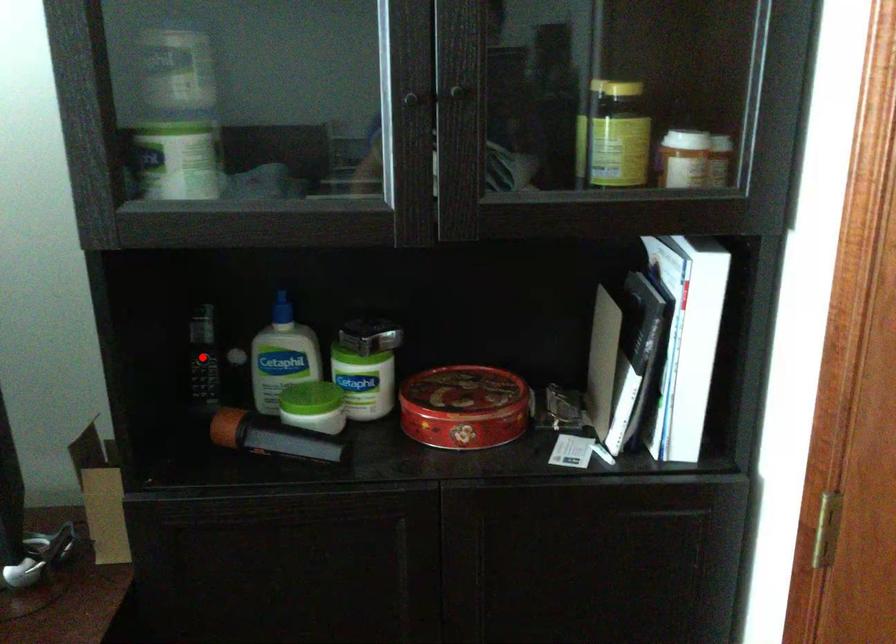
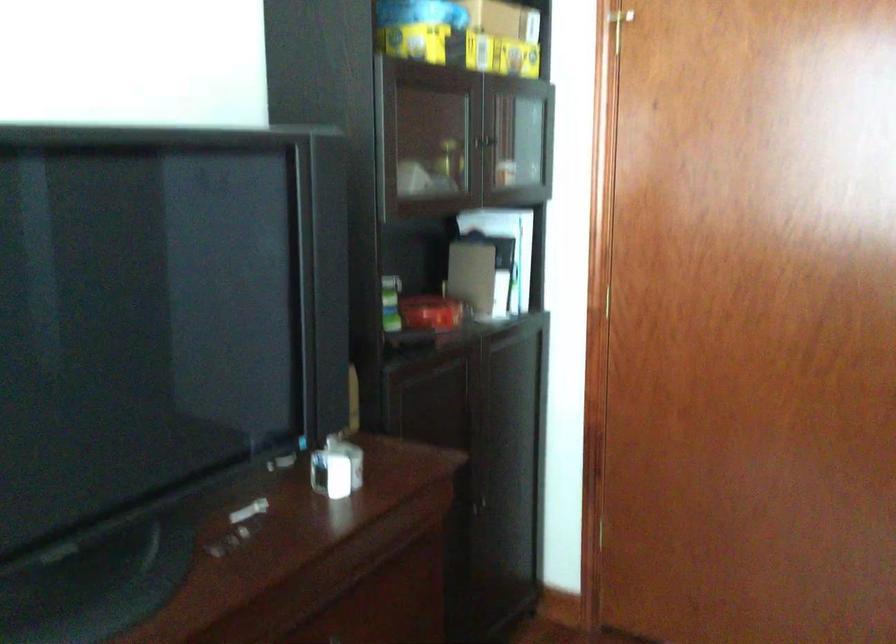
Question: I am providing you with two images of the same scene from different viewpoints. A red point is marked on the first image. At the location where the point appears in image 1, is it still visible in image 2?

Choices:
 (A) Yes
 (B) No

Answer: (B)